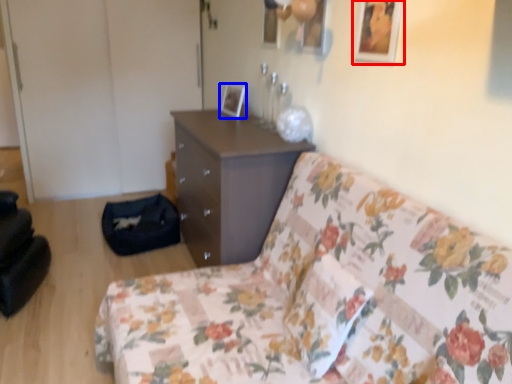
Question: Which object is closer to the camera taking this photo, picture frame (highlighted by a red box) or picture frame (highlighted by a blue box)?

Choices:
 (A) picture frame
 (B) picture frame

Answer: (A)